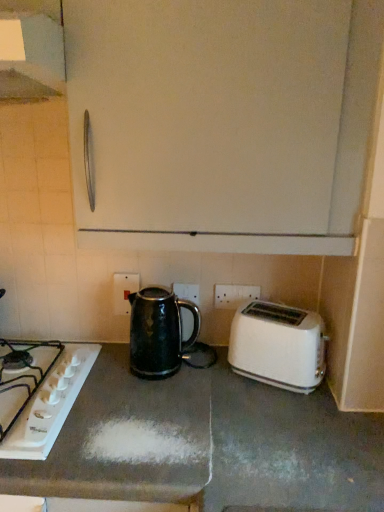
Where is `free space to the left of black glossy kettle at center`? This screenshot has width=384, height=512. free space to the left of black glossy kettle at center is located at coordinates click(x=108, y=367).